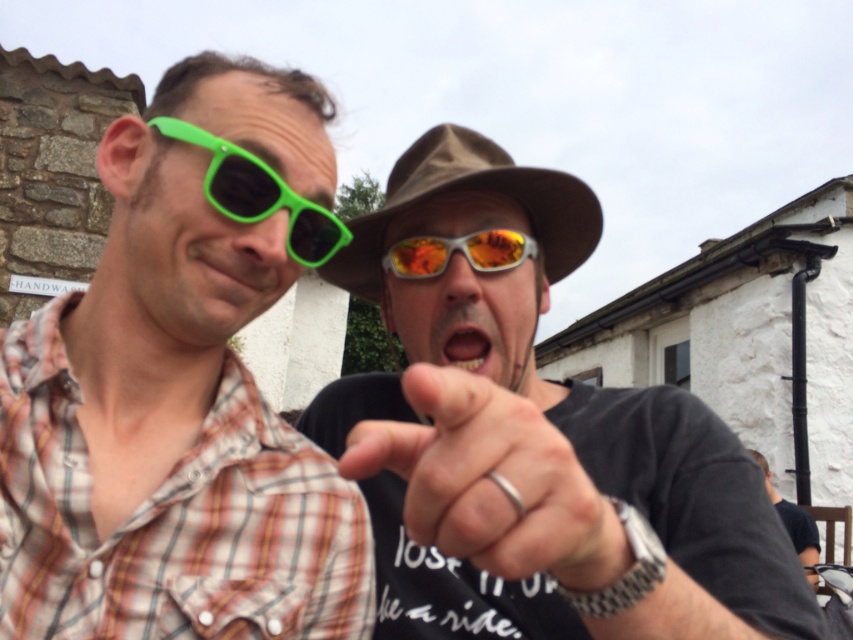
Between matte green sunglasses at upper left and shiny orange reflective goggles at center, which one has more height?

With more height is matte green sunglasses at upper left.

Between point (276, 284) and point (462, 241), which one is positioned in front?

Positioned in front is point (276, 284).

Find the location of a particular element. Image resolution: width=853 pixels, height=640 pixels. matte green sunglasses at upper left is located at coordinates (234, 273).

Is point (460, 460) more distant than point (773, 500)?

No, it is not.

Can you confirm if silver metallic ring at center is wider than matte black shirt at center?

No.

Which is in front, point (570, 554) or point (810, 579)?

Point (570, 554) is more forward.

Identify the location of silver metallic ring at center. (492, 481).

Does point (323, 220) come farther from viewer compared to point (791, 516)?

No, (323, 220) is closer to viewer.

Does point (314, 221) come in front of point (804, 561)?

Yes, point (314, 221) is in front of point (804, 561).

Find the location of a particular element. This screenshot has height=640, width=853. green plastic sunglasses at left is located at coordinates (259, 195).